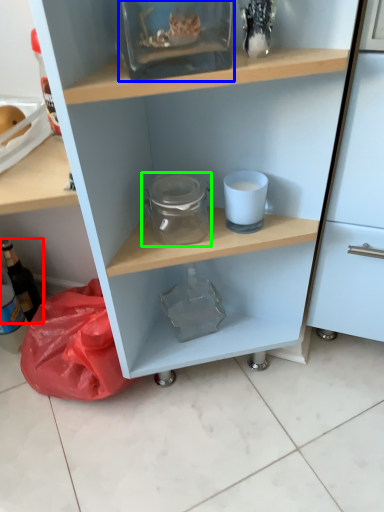
Question: Considering the real-world distances, which object is closest to bottle (highlighted by a red box)? glass box (highlighted by a blue box) or glass jar (highlighted by a green box).

Choices:
 (A) glass box
 (B) glass jar

Answer: (B)